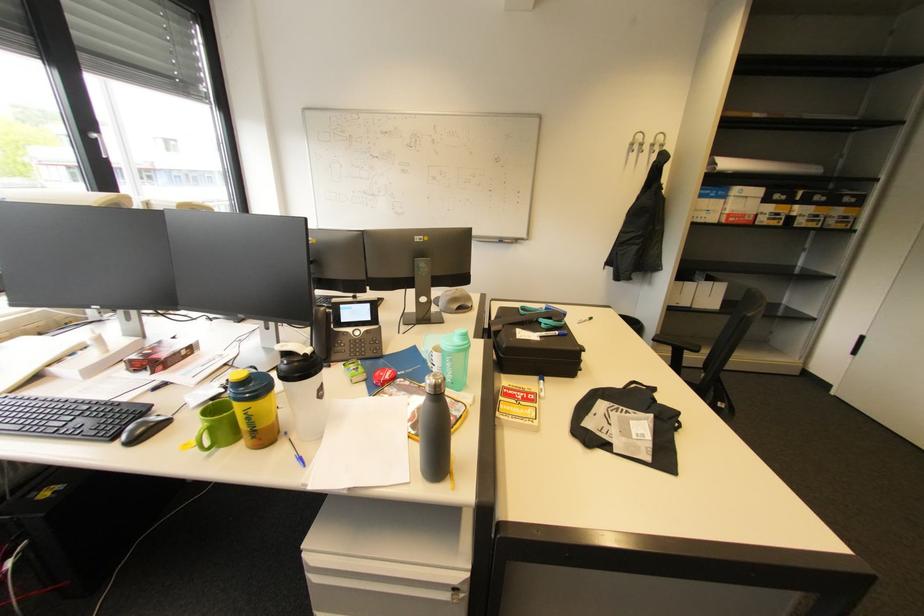
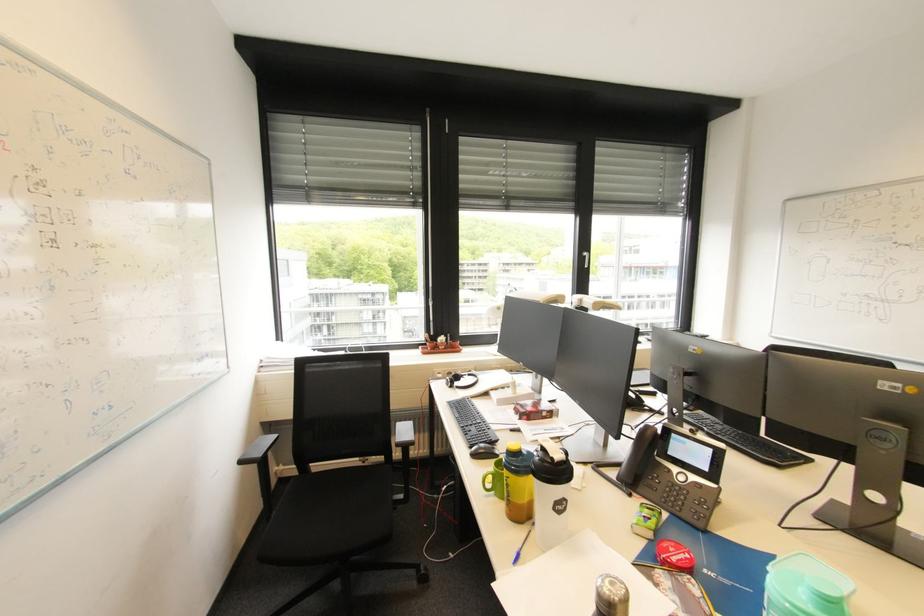
Question: The camera is either moving clockwise (left) or counter-clockwise (right) around the object. The first image is from the beginning of the video and the second image is from the end. Is the camera moving left or right when shooting the video?

Choices:
 (A) Left
 (B) Right

Answer: (B)